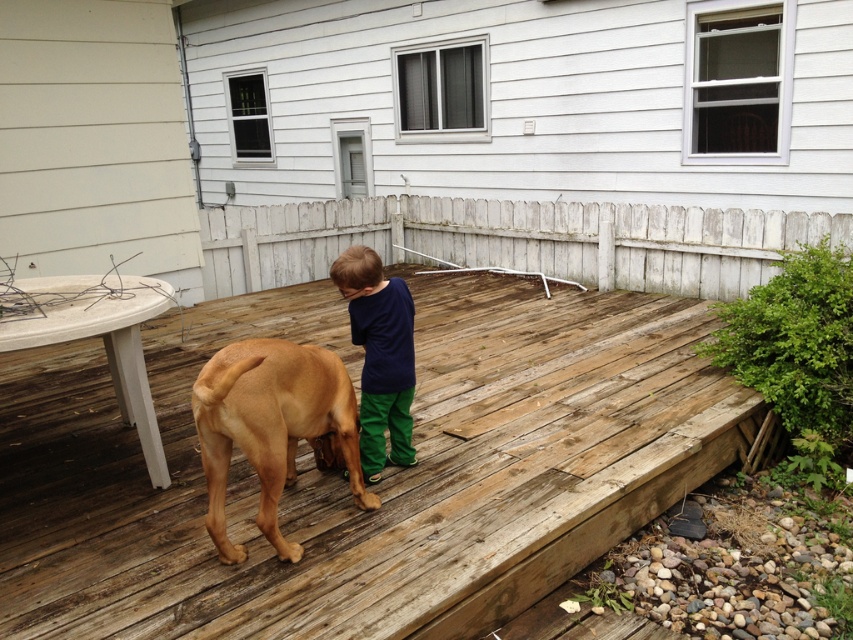
You are a photographer trying to capture a photo of the brown smooth dog at center and the dark blue cotton shirt at center. To ensure both are in focus, you need to know their vertical positions. Which one is lower in the frame?

The brown smooth dog at center is located below the dark blue cotton shirt at center, so the dog is lower in the frame.

Looking at this image, you are a delivery person trying to place a large package on the weathered wood deck at center. The package is as wide as the brown smooth dog at center. Will the deck be wide enough to accommodate the package?

The weathered wood deck at center is wider than the brown smooth dog at center, so the deck should be wide enough to accommodate the package since the package is as wide as the dog.